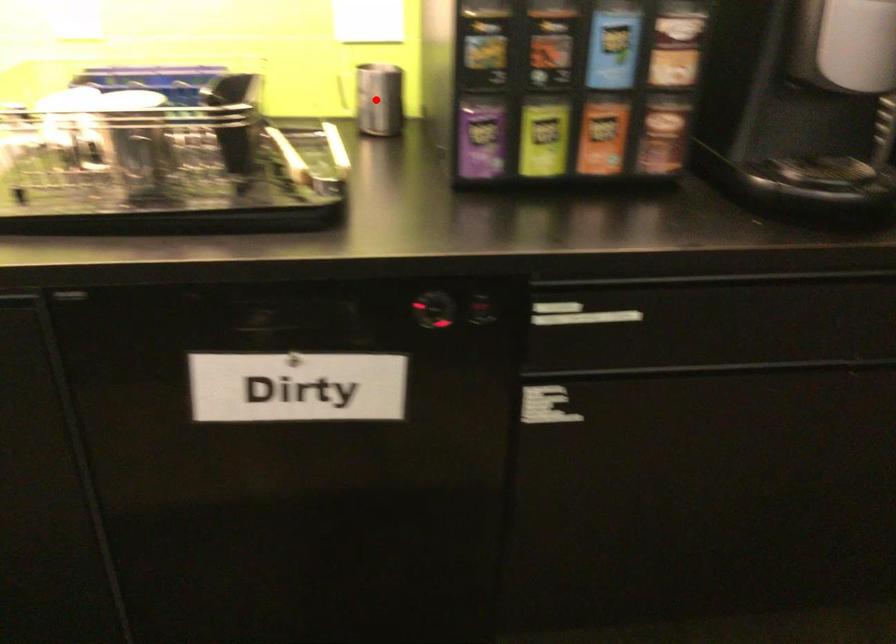
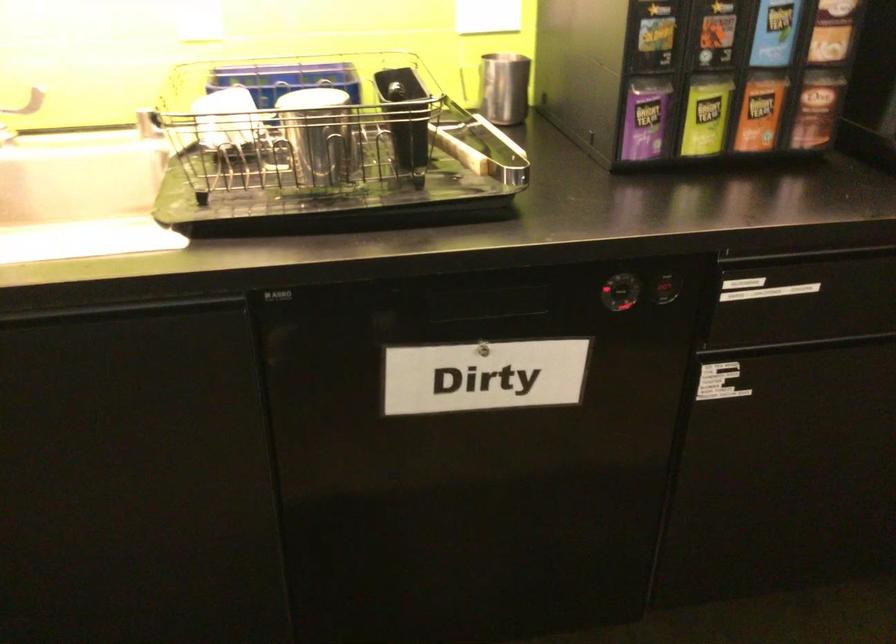
In the second image, find the point that corresponds to the highlighted location in the first image.

(504, 88)